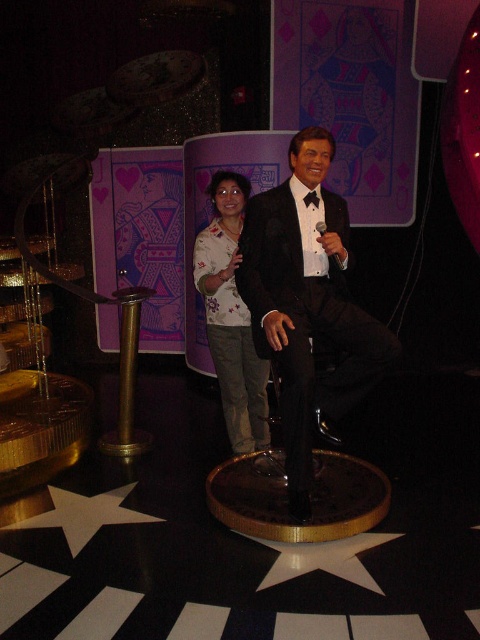
This screenshot has width=480, height=640. Describe the element at coordinates (307, 301) in the screenshot. I see `shiny black suit at center` at that location.

Is point (294, 339) closer to camera compared to point (252, 378)?

Yes.

Does point (295, 417) come in front of point (225, 401)?

Yes, point (295, 417) is in front of point (225, 401).

This screenshot has height=640, width=480. Identify the location of shiny black suit at center. (307, 301).

Is point (284, 337) closer to viewer compared to point (324, 228)?

Yes.

Is shiny black suit at center shorter than black plastic microphone at center?

No.

This screenshot has width=480, height=640. Describe the element at coordinates (307, 301) in the screenshot. I see `shiny black suit at center` at that location.

Where is `shiny black suit at center`? The width and height of the screenshot is (480, 640). shiny black suit at center is located at coordinates (307, 301).

Between floral shirt at center and black plastic microphone at center, which one has more height?

floral shirt at center

Measure the distance between point (245,371) and camera.

3.73 meters

Measure the distance between point (223,282) and camera.

Point (223,282) is 3.33 meters from camera.

Locate an element on the screen. This screenshot has width=480, height=640. floral shirt at center is located at coordinates (230, 316).